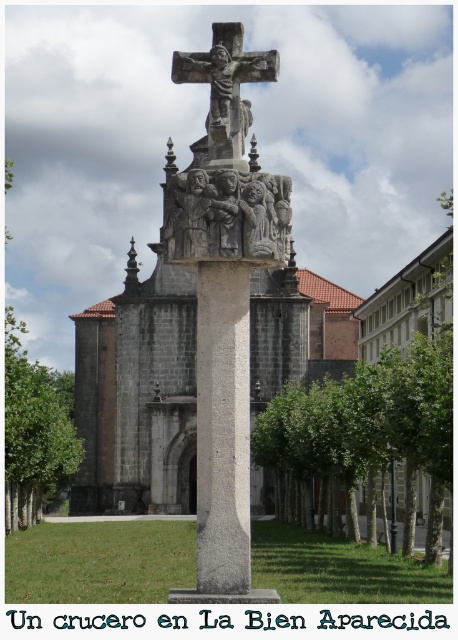
You are standing at a distance and want to take a photo of the matte stone statue at center. The recommended distance for clear photos of statues is at least 50 meters. Is your current position suitable for taking a clear photo?

The matte stone statue at center and camera are 61.58 meters apart from each other, which exceeds the recommended 50 meters distance. Therefore, your current position is suitable for taking a clear photo.

You are standing in front of the church courtyard and want to take a photo of both the matte stone statue at center and the polished stone crucifix at center. Which object should you focus on first to ensure both are in clear view?

You should focus on the matte stone statue at center first since it is closer to you than the polished stone crucifix at center, ensuring both are in focus when taking the photo.